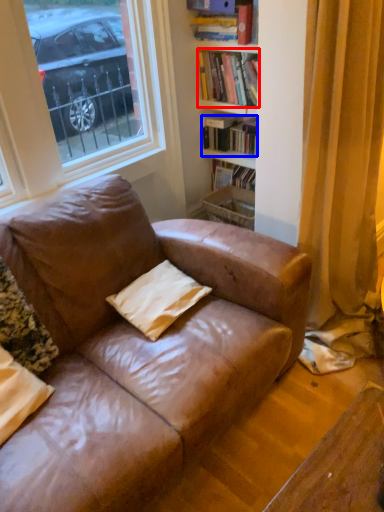
Question: Which object is closer to the camera taking this photo, book (highlighted by a red box) or book (highlighted by a blue box)?

Choices:
 (A) book
 (B) book

Answer: (A)